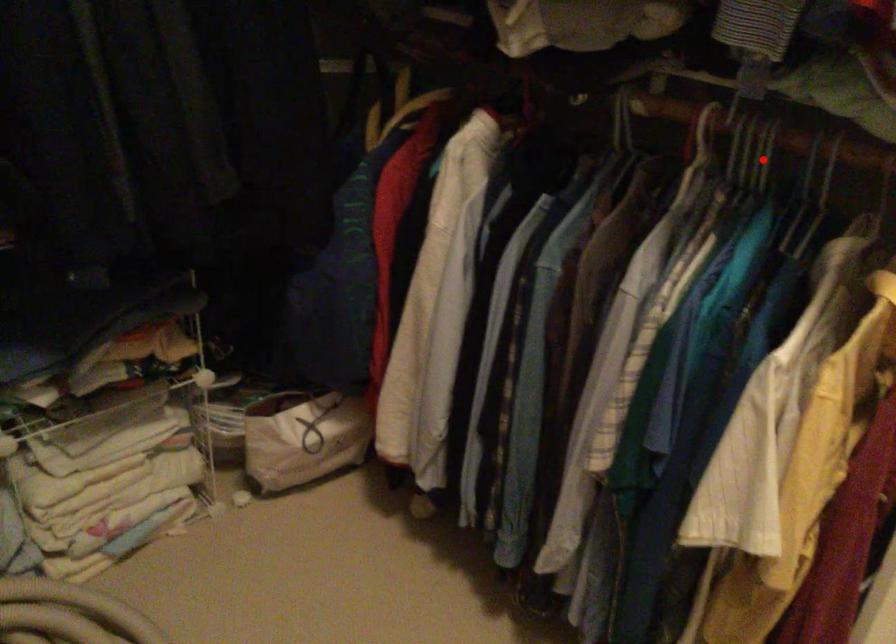
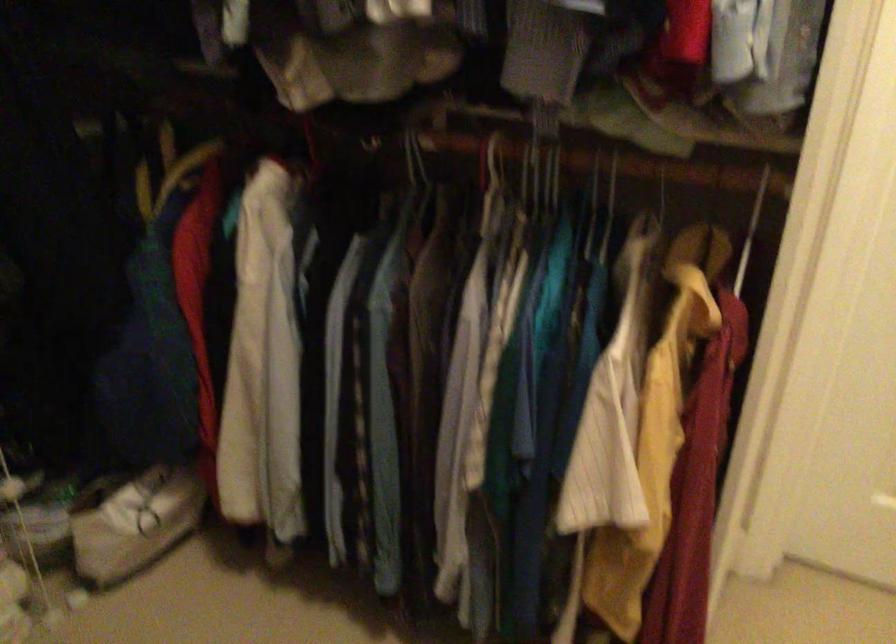
Question: I am providing you with two images of the same scene from different viewpoints. A red point is shown in image1. For the corresponding object point in image2, is it positioned nearer or farther from the camera?

Choices:
 (A) Nearer
 (B) Farther

Answer: (B)